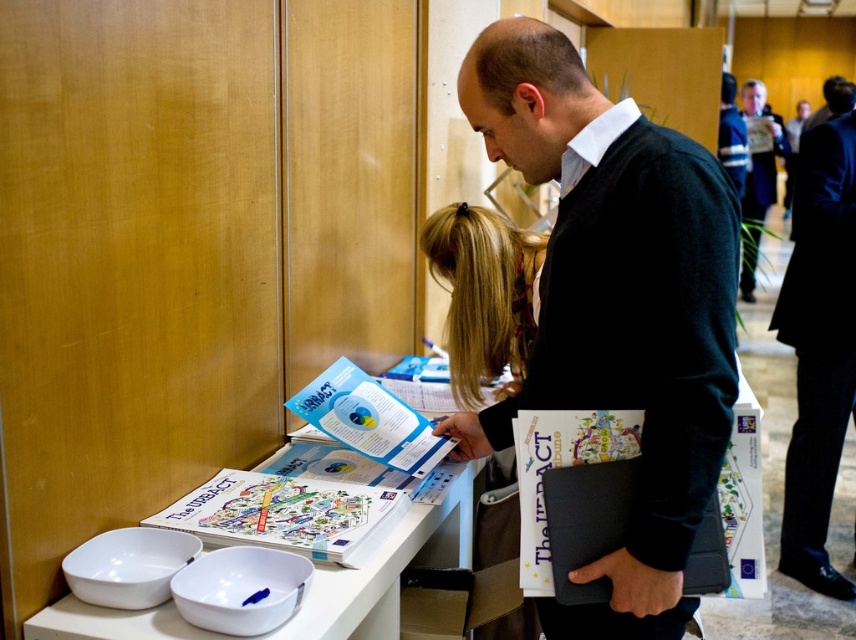
You are a photographer standing at the back of the room. You want to take a photo of the blonde hair at center and the dark blue suit at upper right so that both are clearly visible in the frame. Given that your camera has a maximum focus range of 5 meters, will you be able to capture both subjects in focus without moving closer?

The distance between the blonde hair at center and the dark blue suit at upper right is 5.65 meters. Since the camera can only focus within 5 meters, the subjects are too far apart to be both in focus simultaneously. You would need to adjust your position or use a different camera setting to accommodate the distance.

You are a photographer at the event and need to capture a clear shot of both the blonde hair at center and the dark blue suit at upper right. Based on their positions, which object is closer to the camera?

The blonde hair at center is positioned under dark blue suit at upper right, which means the dark blue suit at upper right is closer to the camera.

From the picture: You are a photographer at the event and need to capture a photo where both the black sweater at center and the black suit at right are visible. Based on their heights, which one should be positioned closer to the camera to ensure both are fully visible in the frame?

The black sweater at center is shorter than the black suit at right, so positioning the black sweater at center closer to the camera will ensure both are fully visible in the frame.